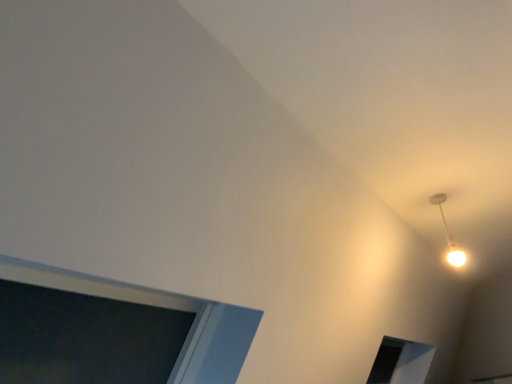
Identify the location of white glossy ceiling light at upper right. The height and width of the screenshot is (384, 512). (449, 234).

Describe the element at coordinates (449, 234) in the screenshot. I see `white glossy ceiling light at upper right` at that location.

You are a GUI agent. You are given a task and a screenshot of the screen. Output one action in this format:
    pyautogui.click(x=<x>, y=<y>)
    Task: Click on the white glossy ceiling light at upper right
    The width and height of the screenshot is (512, 384).
    Given the screenshot: What is the action you would take?
    pyautogui.click(x=449, y=234)